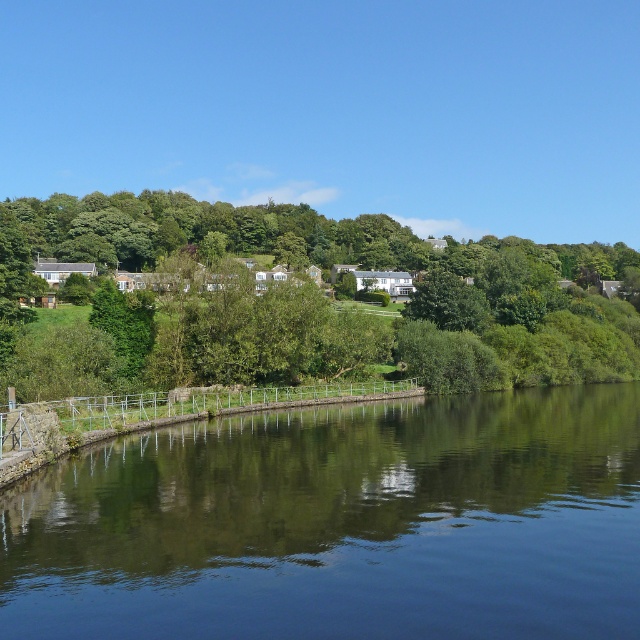
Does point (58, 554) lie in front of point (592, 253)?

Yes.

What do you see at coordinates (340, 524) in the screenshot? I see `dark blue water at center` at bounding box center [340, 524].

Find the location of a particular element. This screenshot has height=640, width=640. dark blue water at center is located at coordinates [340, 524].